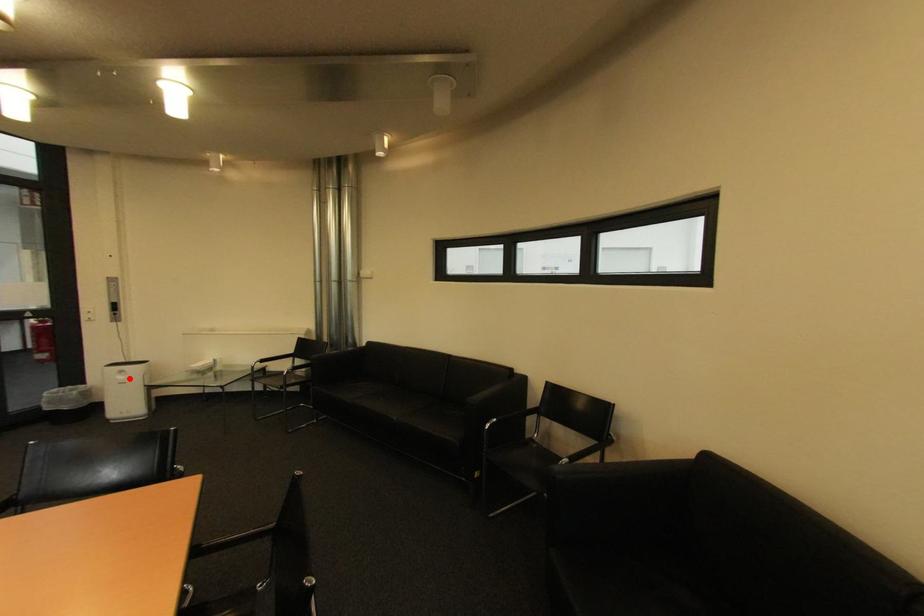
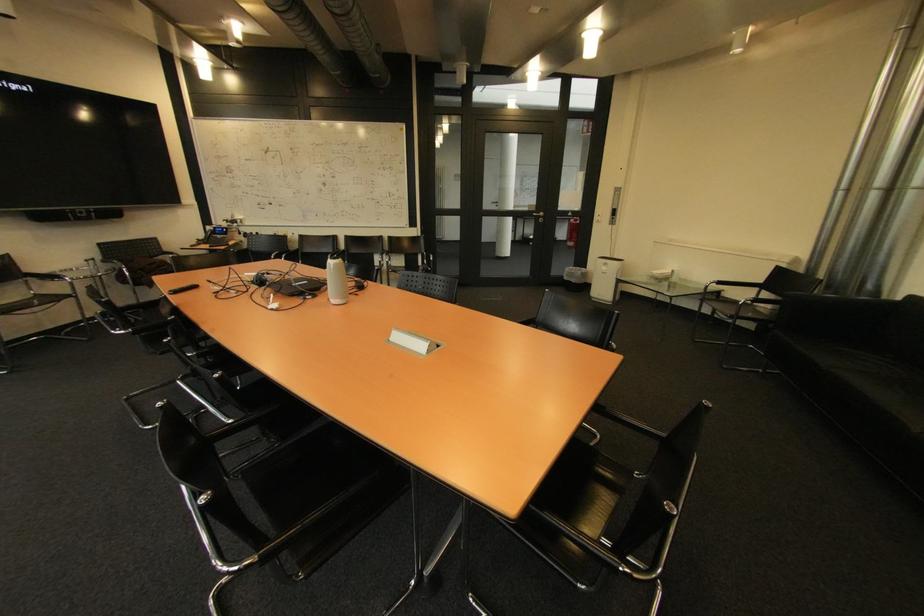
Locate, in the second image, the point that corresponds to the highlighted location in the first image.

(613, 270)